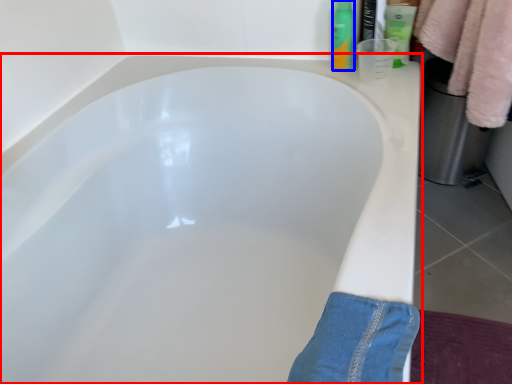
Question: Which object is closer to the camera taking this photo, bathtub (highlighted by a red box) or toiletry (highlighted by a blue box)?

Choices:
 (A) bathtub
 (B) toiletry

Answer: (A)